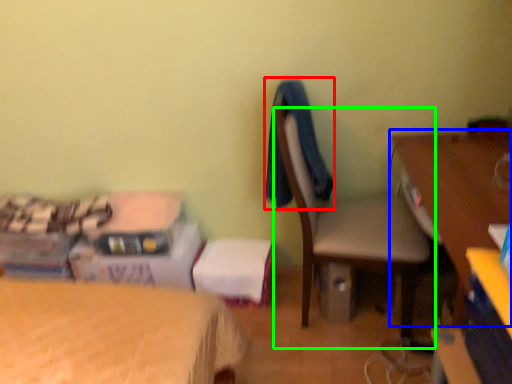
Question: Which object is positioned farthest from clothing (highlighted by a red box)? Select from desk (highlighted by a blue box) and chair (highlighted by a green box).

Choices:
 (A) desk
 (B) chair

Answer: (A)